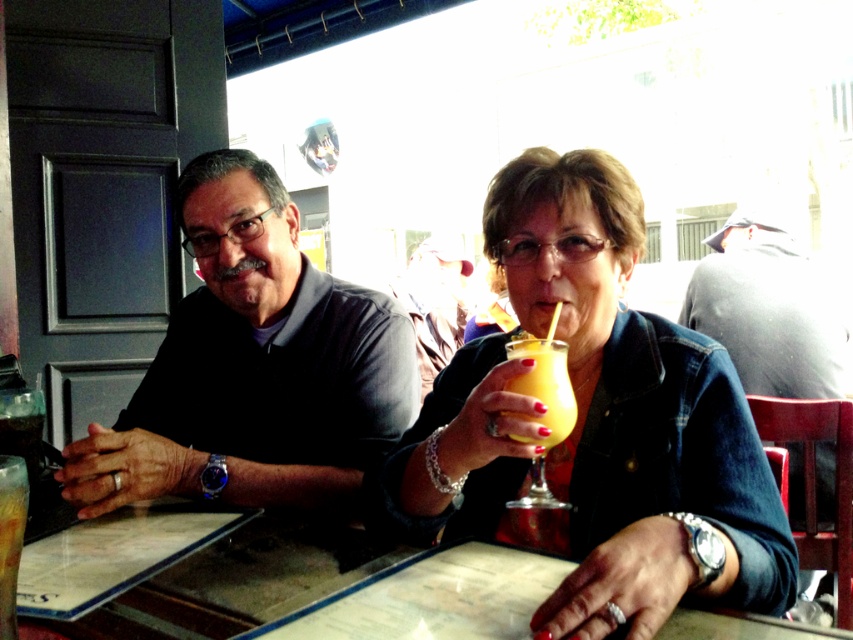
You are a delivery person carrying a package that is 12 inches long. You need to place it on the table between the clear glass table at center and the translucent glass at upper center. Is there enough space to place the package horizontally?

The clear glass table at center is 11.15 inches away from the translucent glass at upper center. Since the package is 12 inches long, which is longer than the distance between them, there is not enough space to place the package horizontally between the clear glass table at center and the translucent glass at upper center.

You are a photographer taking a portrait of the dark gray shirt at left and the translucent glass at upper center. Which object should you focus on first to ensure it is in sharp focus if you want the other to be slightly blurry?

You should focus on the dark gray shirt at left first because it is positioned over the translucent glass at upper center, so focusing on the closer object will keep it sharp while the background may appear blurry.

You are a waiter at the outdoor cafe and need to deliver a drink to the table. The matte orange glass at center is currently on the clear glass table at center. Where exactly should you place the new drink to avoid blocking the menu?

The new drink should be placed on the clear glass table at center, not on top of the matte orange glass at center, to ensure the menu remains visible and unobstructed.